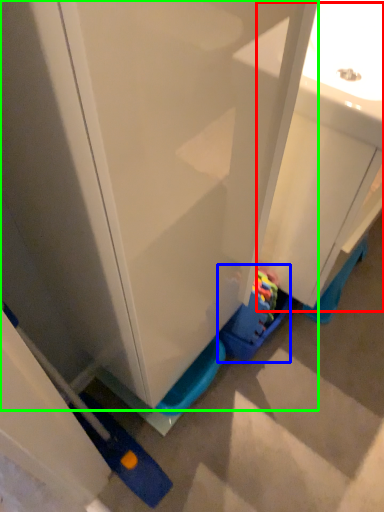
Question: Which is nearer to the sink (highlighted by a red box)? toy (highlighted by a blue box) or cabinetry (highlighted by a green box).

Choices:
 (A) toy
 (B) cabinetry

Answer: (B)